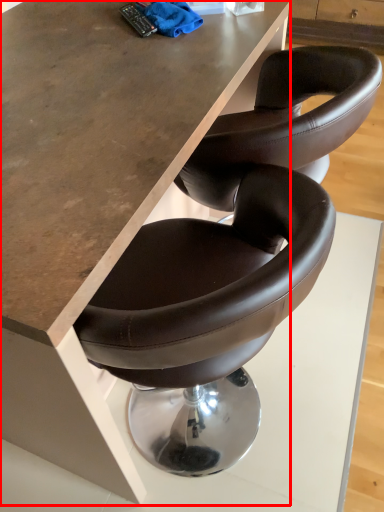
Question: Where is table (annotated by the red box) located in relation to material in the image?

Choices:
 (A) left
 (B) right

Answer: (A)